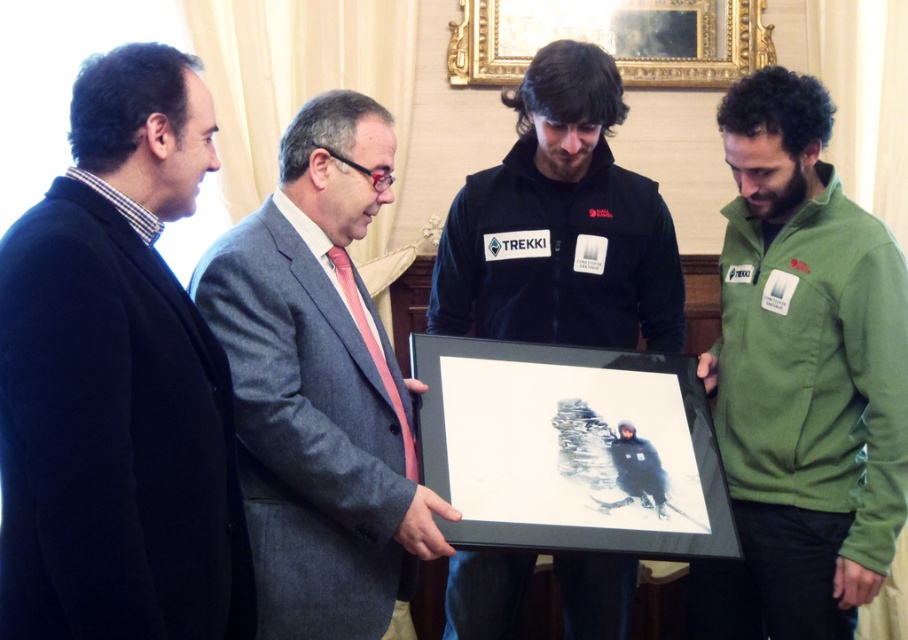
Question: Where is green fleece jacket at center located in relation to black matte picture frame at center in the image?

Choices:
 (A) right
 (B) left

Answer: (A)

Question: Does black fleece jacket at center appear on the left side of gold/gilded picture frame at upper center?

Choices:
 (A) yes
 (B) no

Answer: (A)

Question: Does gray wool suit at center have a smaller size compared to black matte picture frame at center?

Choices:
 (A) no
 (B) yes

Answer: (A)

Question: Which object is positioned farthest from the black wool coat at left?

Choices:
 (A) black matte picture frame at center
 (B) black fleece jacket at center

Answer: (B)

Question: Among these objects, which one is farthest from the camera?

Choices:
 (A) black fleece jacket at center
 (B) black matte picture frame at center
 (C) gold/gilded picture frame at upper center

Answer: (C)

Question: Which object appears closest to the camera in this image?

Choices:
 (A) black matte picture frame at center
 (B) black wool coat at left

Answer: (B)